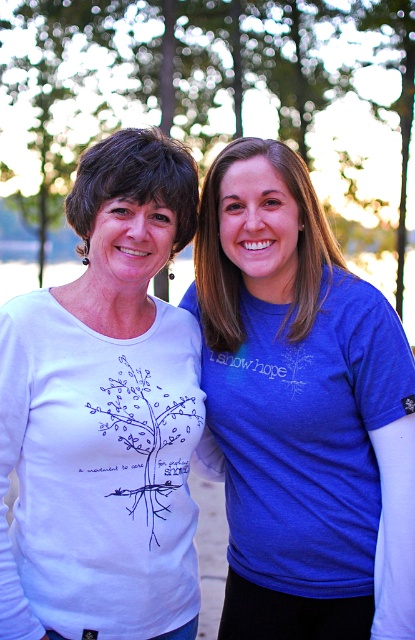
Question: Is matte white shirt at left further to the viewer compared to white matte shirt at left?

Choices:
 (A) yes
 (B) no

Answer: (A)

Question: Can you confirm if matte white shirt at left is positioned below white matte shirt at left?

Choices:
 (A) no
 (B) yes

Answer: (B)

Question: Among these objects, which one is nearest to the camera?

Choices:
 (A) matte white shirt at left
 (B) white matte tree at center
 (C) white matte shirt at left

Answer: (C)

Question: Which point is farther from the camera taking this photo?

Choices:
 (A) (161, 508)
 (B) (310, 58)
 (C) (278, 257)

Answer: (B)

Question: Among these points, which one is farthest from the camera?

Choices:
 (A) (388, 513)
 (B) (376, 132)
 (C) (27, 321)

Answer: (B)

Question: Is matte white shirt at left wider than white matte tree at center?

Choices:
 (A) yes
 (B) no

Answer: (B)